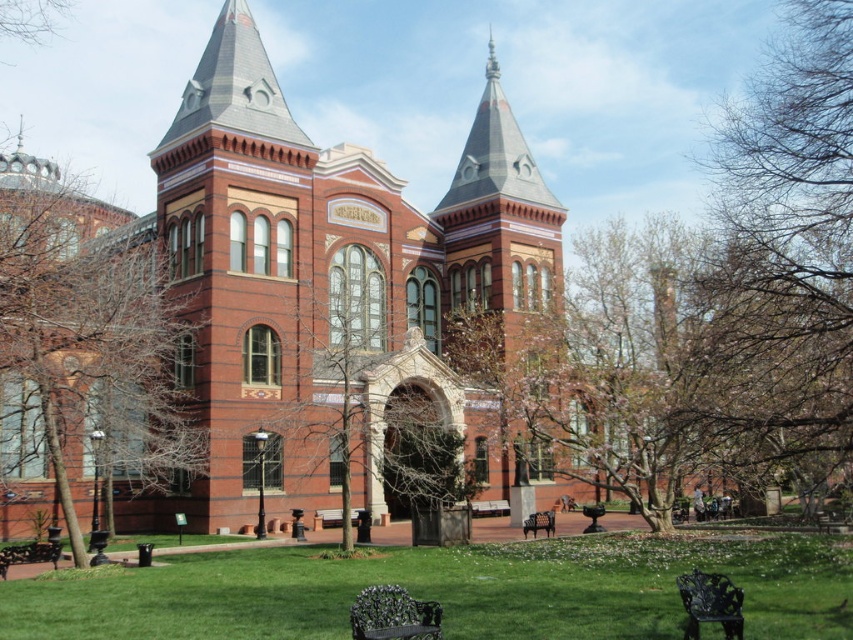
You are a visitor standing at the front entrance of the grand historic building. You notice a bare wood tree at center and a wooden park bench at lower left. Which object is taller from your viewpoint?

The bare wood tree at center is taller than the wooden park bench at lower left.

You are a visitor at this historic building and want to sit on the wooden park bench at lower left to enjoy the view of the building. However, there is a bare wood tree at center in the way. Is the tree blocking your view of the building?

The bare wood tree at center is positioned on the right side of the wooden park bench at lower left, so it may block the view depending on its height and spread. However, since the tree is described as bare, it might not obstruct the view as much as a leafy tree would. Without specific details on the tree height or spread, we can only note its position relative to the bench.